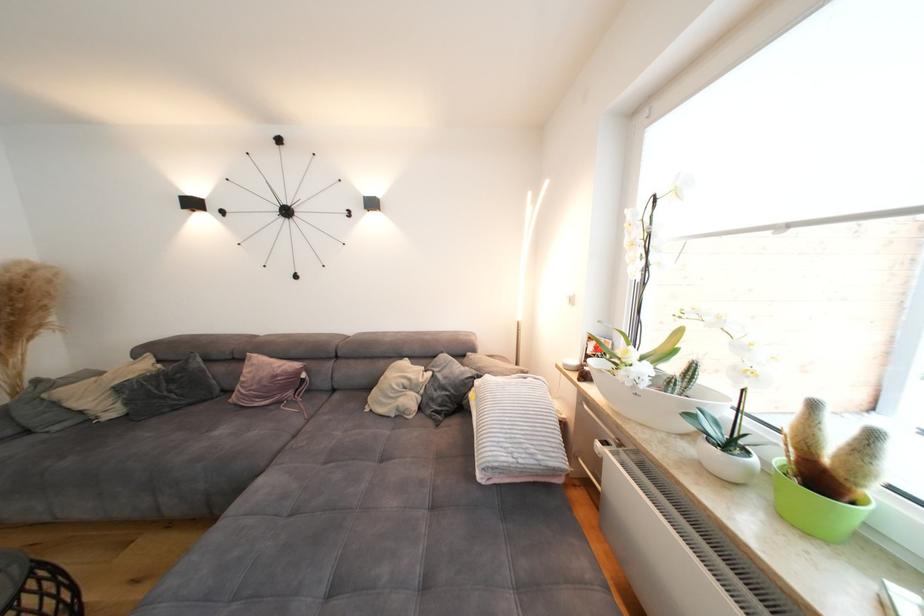
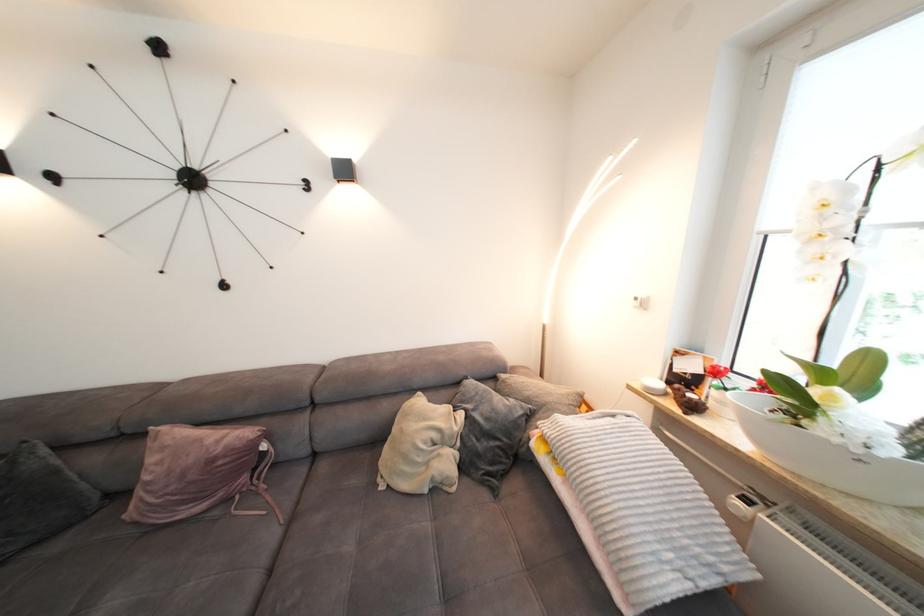
In a continuous first-person perspective shot, in which direction is the camera moving?

The cameraman moved toward left, forward.